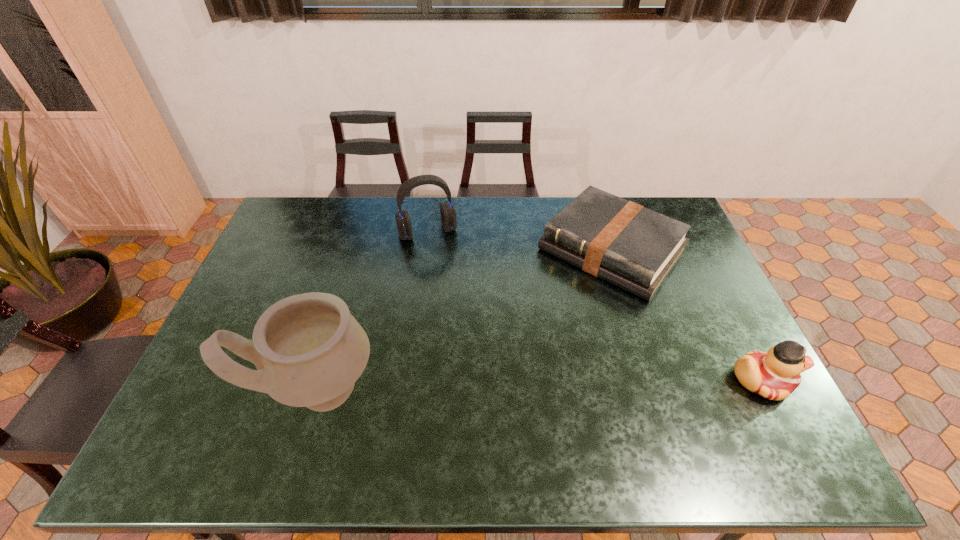
You are a GUI agent. You are given a task and a screenshot of the screen. Output one action in this format:
    pyautogui.click(x=<x>, y=<y>)
    Task: Click on the tallest object
    
    Given the screenshot: What is the action you would take?
    pyautogui.click(x=309, y=351)

This screenshot has width=960, height=540. Identify the location of duck. (774, 375).

This screenshot has width=960, height=540. Find the location of `the second tallest object`. the second tallest object is located at coordinates (447, 211).

At what (x,y) coordinates should I click in order to perform the action: click on the shortest object. Please return your answer as a coordinate pair (x, y). The height and width of the screenshot is (540, 960). Looking at the image, I should click on (630, 246).

Image resolution: width=960 pixels, height=540 pixels. Identify the location of vacant region located 0.140m on the left of the pottery. (204, 388).

Where is `free space located 0.200m on the headband of the second tallest object`? free space located 0.200m on the headband of the second tallest object is located at coordinates (451, 284).

Identify the location of free location located 0.330m on the headband of the second tallest object. Image resolution: width=960 pixels, height=540 pixels. (463, 314).

Image resolution: width=960 pixels, height=540 pixels. Identify the location of vacant point located 0.220m on the headband of the second tallest object. (453, 288).

The image size is (960, 540). In order to click on free space located on the spine side of the hardback book in this screenshot , I will do `click(530, 343)`.

Image resolution: width=960 pixels, height=540 pixels. Identify the location of vacant space situated 0.280m on the spine side of the hardback book. (523, 349).